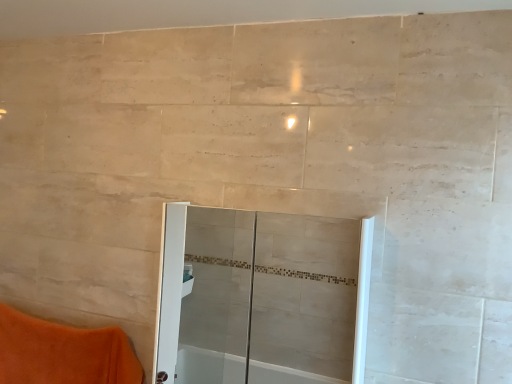
The height and width of the screenshot is (384, 512). Find the location of `white glossy shower door at center`. white glossy shower door at center is located at coordinates (262, 298).

This screenshot has height=384, width=512. What do you see at coordinates (262, 298) in the screenshot? I see `white glossy shower door at center` at bounding box center [262, 298].

Locate an element on the screen. The image size is (512, 384). white glossy shower door at center is located at coordinates (262, 298).